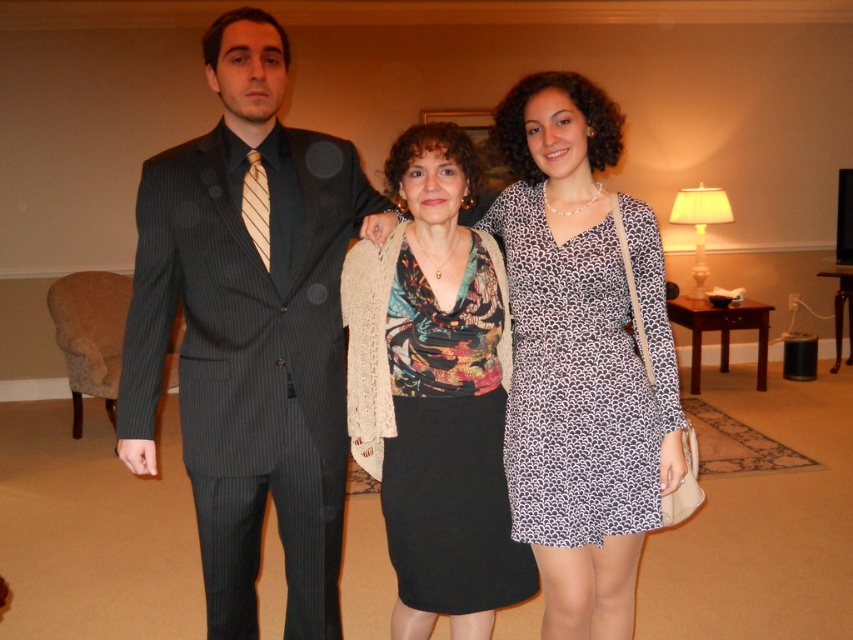
Question: Which of the following is the closest to the observer?

Choices:
 (A) (196, 244)
 (B) (614, 372)
 (C) (428, 429)
 (D) (120, 449)

Answer: (A)

Question: Does dark gray pinstripe suit at center have a greater width compared to matte black suit at left?

Choices:
 (A) no
 (B) yes

Answer: (A)

Question: Which point appears farthest from the camera in this image?

Choices:
 (A) click(518, 531)
 (B) click(492, 424)
 (C) click(236, 308)

Answer: (B)

Question: Is black textured skirt at center closer to camera compared to leopard print dress at center?

Choices:
 (A) yes
 (B) no

Answer: (A)

Question: Among these objects, which one is nearest to the camera?

Choices:
 (A) matte black suit at left
 (B) black textured skirt at center
 (C) leopard print dress at center
 (D) dark gray pinstripe suit at center

Answer: (D)

Question: Does black textured skirt at center appear on the left side of leopard print dress at center?

Choices:
 (A) yes
 (B) no

Answer: (A)